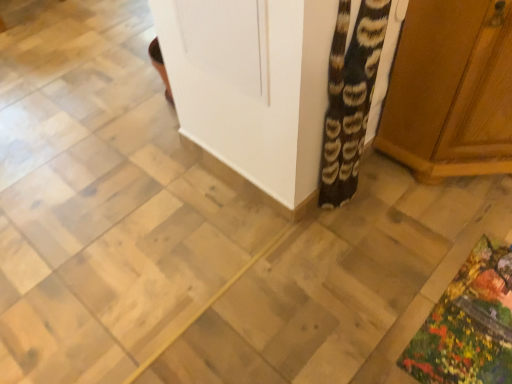
Describe the element at coordinates (350, 98) in the screenshot. I see `black and white patterned blanket at center` at that location.

Find the location of a particular element. The height and width of the screenshot is (384, 512). black and white patterned blanket at center is located at coordinates (350, 98).

The width and height of the screenshot is (512, 384). I want to click on black and white patterned blanket at center, so click(350, 98).